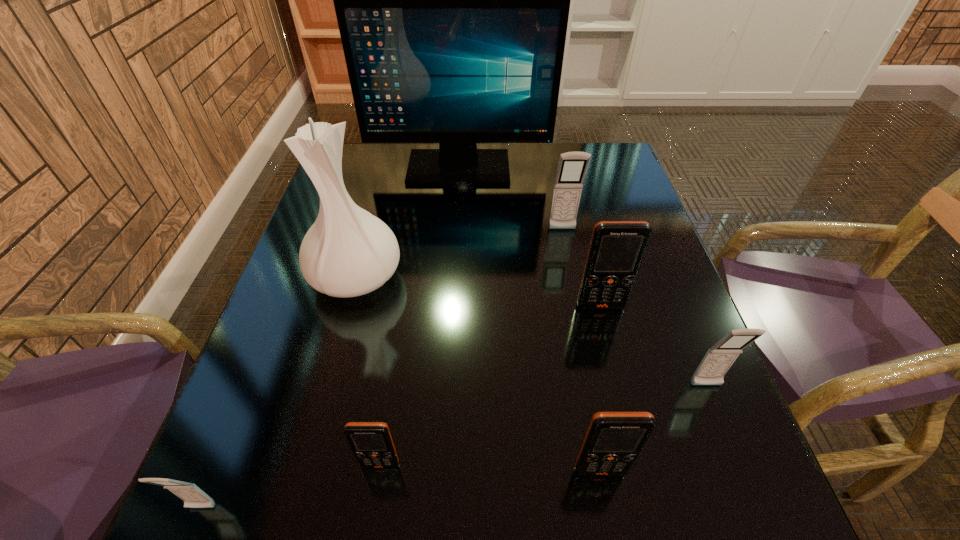
Image resolution: width=960 pixels, height=540 pixels. What are the coordinates of `the second smallest orange cellular telephone` in the screenshot? It's located at (613, 441).

The width and height of the screenshot is (960, 540). I want to click on the leftmost orange cellular telephone, so click(371, 442).

Find the location of a particular element. the smallest orange cellular telephone is located at coordinates (371, 442).

This screenshot has width=960, height=540. Identify the location of the smallest gray cellular telephone. (193, 497).

Locate an element on the screen. The image size is (960, 540). the nearest object is located at coordinates (193, 497).

This screenshot has height=540, width=960. I want to click on blank area located on the screen side of the farthest object, so click(x=455, y=226).

At what (x,y) coordinates should I click in order to perform the action: click on vacant space located 0.230m on the right of the white vase. Please return your answer as a coordinate pair (x, y). Looking at the image, I should click on (506, 277).

Identify the location of vacant region located 0.210m on the front-facing side of the biggest gray cellular telephone. (576, 298).

Identify the location of vacant area situated 0.210m on the screen of the second farthest cellular telephone. The image size is (960, 540). (625, 404).

The image size is (960, 540). Find the location of `vacant region located 0.050m on the front-facing side of the rightmost gray cellular telephone`. vacant region located 0.050m on the front-facing side of the rightmost gray cellular telephone is located at coordinates (719, 418).